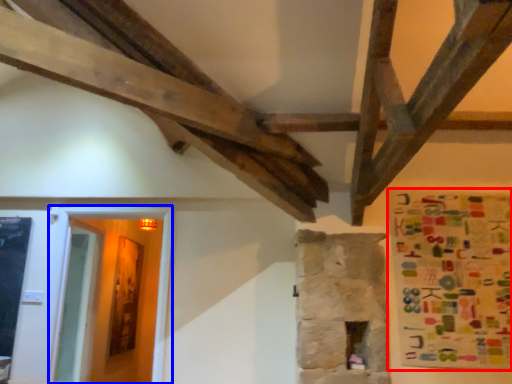
Question: Among these objects, which one is nearest to the camera, poster (highlighted by a red box) or glass door (highlighted by a blue box)?

Choices:
 (A) poster
 (B) glass door

Answer: (A)